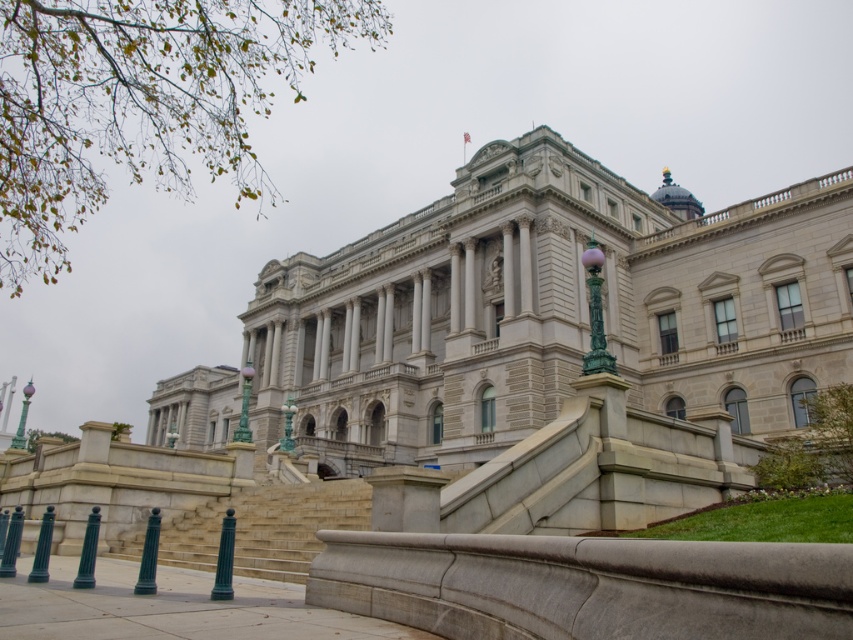
Which of these two, green matte pole at lower left or matte green pole at lower left, stands taller?

green matte pole at lower left is taller.

Image resolution: width=853 pixels, height=640 pixels. Identify the location of green matte pole at lower left. (149, 556).

Who is more forward, (144, 580) or (97, 525)?

Point (144, 580) is in front.

Locate an element on the screen. The height and width of the screenshot is (640, 853). green matte pole at lower left is located at coordinates (149, 556).

Does green polished metal pole at lower center have a lesser width compared to green polished metal pole at lower left?

Yes.

Can you confirm if green polished metal pole at lower center is bigger than green polished metal pole at lower left?

Incorrect, green polished metal pole at lower center is not larger than green polished metal pole at lower left.

Identify the location of green polished metal pole at lower center. The width and height of the screenshot is (853, 640). (224, 560).

Does green polished metal pole at lower center have a lesser height compared to green polished metal lamp post at lower left?

Indeed, green polished metal pole at lower center has a lesser height compared to green polished metal lamp post at lower left.

Which of these two, green polished metal pole at lower center or green polished metal lamp post at lower left, stands taller?

Standing taller between the two is green polished metal lamp post at lower left.

Find the location of a particular element. The image size is (853, 640). green polished metal pole at lower center is located at coordinates (224, 560).

What are the coordinates of `green polished metal pole at lower center` in the screenshot? It's located at (224, 560).